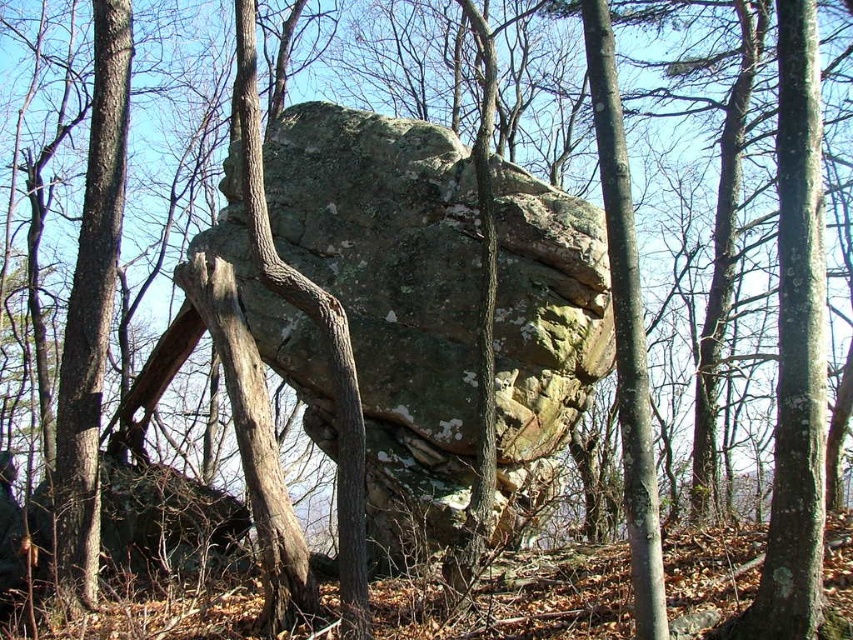
Which of these two, lichen-covered rock at center or smooth bark tree trunk at center, stands taller?

Standing taller between the two is lichen-covered rock at center.

Between point (370, 163) and point (618, 189), which one is positioned behind?

Positioned behind is point (370, 163).

Locate an element on the screen. lichen-covered rock at center is located at coordinates (392, 298).